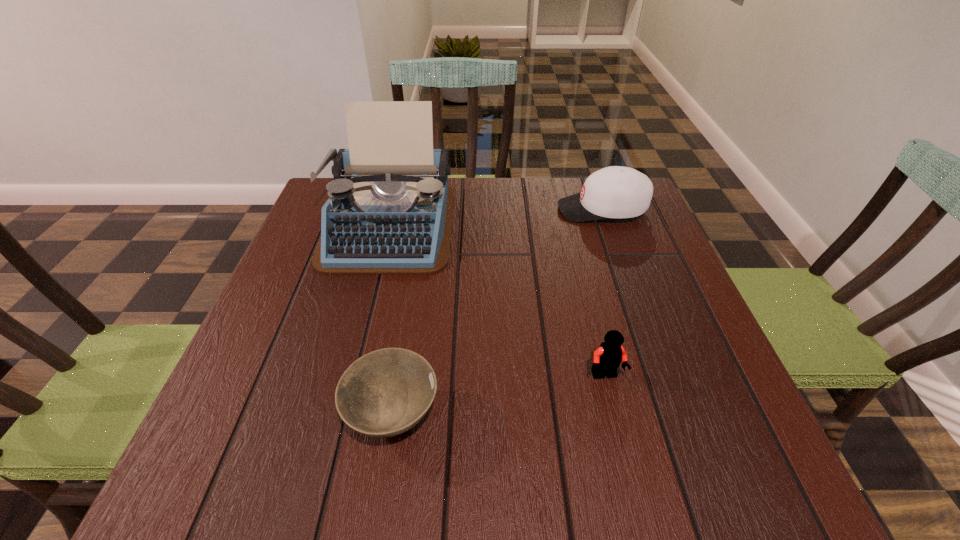
Where is `typewriter at the far edge`? The width and height of the screenshot is (960, 540). typewriter at the far edge is located at coordinates (390, 208).

In order to click on baseball cap that is at the far edge in this screenshot , I will do `click(613, 192)`.

Locate an element on the screen. object at the near edge is located at coordinates (386, 392).

Locate an element on the screen. The width and height of the screenshot is (960, 540). object present at the left edge is located at coordinates click(x=390, y=208).

Locate an element on the screen. The width and height of the screenshot is (960, 540). object at the right edge is located at coordinates (613, 192).

At what (x,y) coordinates should I click in order to perform the action: click on object at the far left corner. Please return your answer as a coordinate pair (x, y). The width and height of the screenshot is (960, 540). Looking at the image, I should click on (390, 208).

The width and height of the screenshot is (960, 540). I want to click on object at the far right corner, so click(x=613, y=192).

This screenshot has height=540, width=960. I want to click on free spot at the far edge of the desktop, so click(472, 207).

You are a GUI agent. You are given a task and a screenshot of the screen. Output one action in this format:
    pyautogui.click(x=<x>, y=<y>)
    Task: Click on the vacant space at the near edge of the desktop
    The image size is (960, 540).
    Given the screenshot: What is the action you would take?
    pyautogui.click(x=409, y=447)

In the image, there is a desktop. Identify the location of vacant space at the left edge. (301, 346).